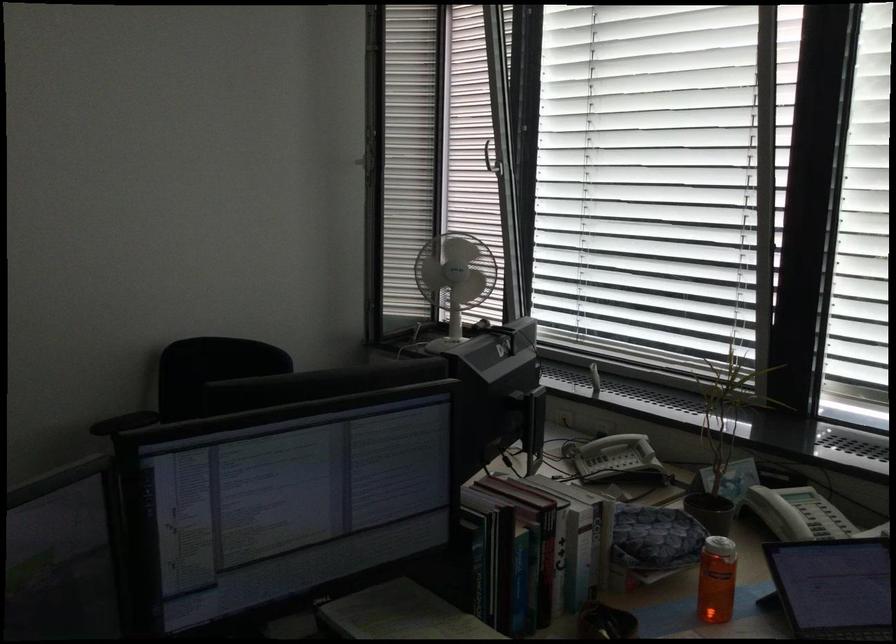
Find where to turn the white window handle. Please return your answer as a coordinate pair (x, y).

(492, 158)